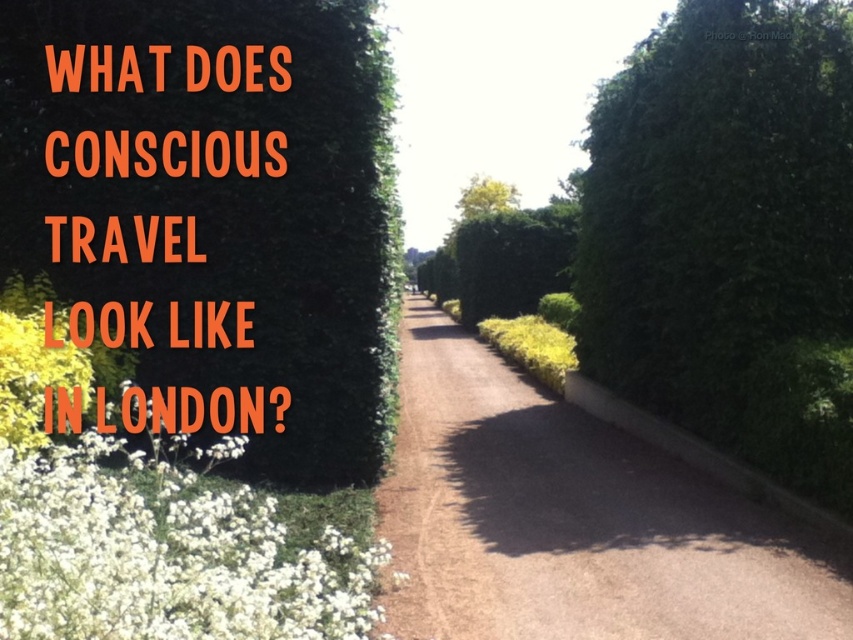
You are standing at the entrance of the pathway and want to walk along the brown gravel driveway at center. According to the coordinates provided, where exactly is the driveway located?

The brown gravel driveway at center is located at point coordinates (575, 520).

You are a gardener who wants to plant a new bush that requires at least 2 meters of space. You see the white fluffy petals at lower left and the green leafy tree at center. Which location would be suitable for planting the bush?

The green leafy tree at center has a greater width than the white fluffy petals at lower left, so the area near the green leafy tree at center would provide enough space for the new bush requiring at least 2 meters.

You are a gardener standing on the pathway and want to collect the white fluffy petals at lower left. Which direction should you move to reach them from the green leafy tree at center?

The white fluffy petals at lower left are to the left of the green leafy tree at center, so you should move to the left to reach them.